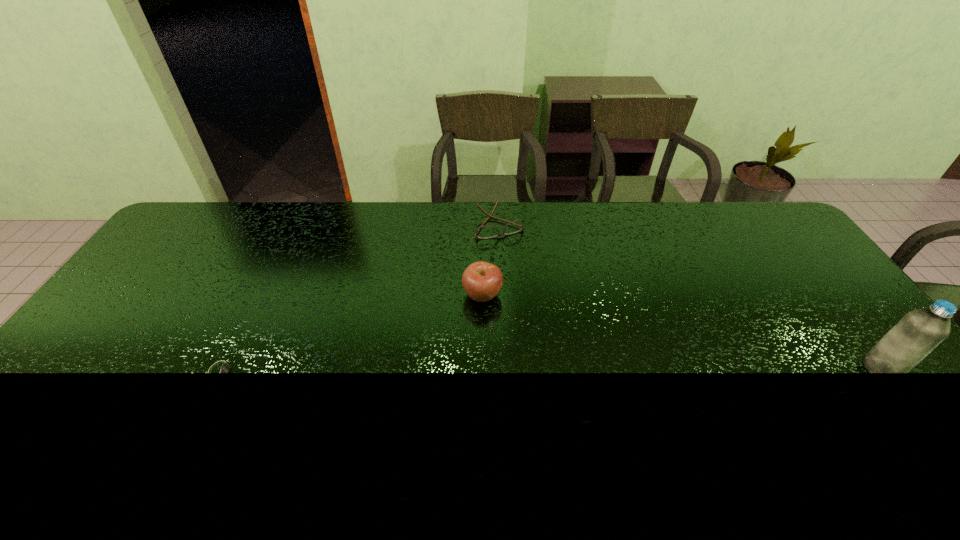
Locate an element on the screen. free space between the second farthest object and the second shortest object is located at coordinates point(491,260).

Find the location of a particular element. This screenshot has height=540, width=960. free spot between the second shortest object and the leftmost object is located at coordinates (359, 298).

At what (x,y) coordinates should I click in order to perform the action: click on free space between the tallest object and the second shortest object. Please return your answer as a coordinate pair (x, y). This screenshot has width=960, height=540. Looking at the image, I should click on (690, 296).

Where is `free area in between the watch and the rightmost object`? free area in between the watch and the rightmost object is located at coordinates (550, 370).

Point out which object is positioned as the nearest to the second tallest object. Please provide its 2D coordinates. Your answer should be formatted as a tuple, i.e. [(x, y)], where the tuple contains the x and y coordinates of a point satisfying the conditions above.

[(483, 232)]

Identify which object is the nearest to the watch. Please provide its 2D coordinates. Your answer should be formatted as a tuple, i.e. [(x, y)], where the tuple contains the x and y coordinates of a point satisfying the conditions above.

[(482, 281)]

The height and width of the screenshot is (540, 960). Find the location of `vacant region that satisfies the following two spatial constraints: 1. on the front side of the water bottle; 2. on the left side of the apple`. vacant region that satisfies the following two spatial constraints: 1. on the front side of the water bottle; 2. on the left side of the apple is located at coordinates (483, 368).

This screenshot has width=960, height=540. What are the coordinates of `free location that satisfies the following two spatial constraints: 1. on the back side of the second tallest object; 2. on the left side of the farthest object` in the screenshot? It's located at (482, 225).